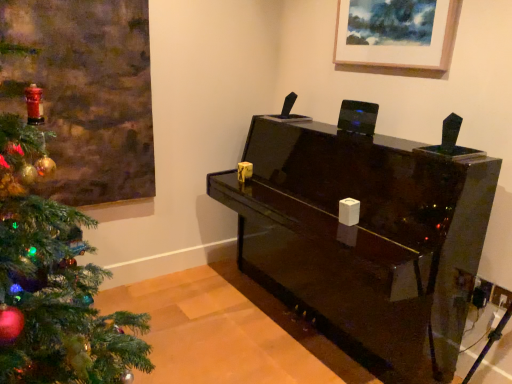
Locate an element on the screen. free space underneath glossy black piano at center (from a real-world perspective) is located at coordinates (291, 338).